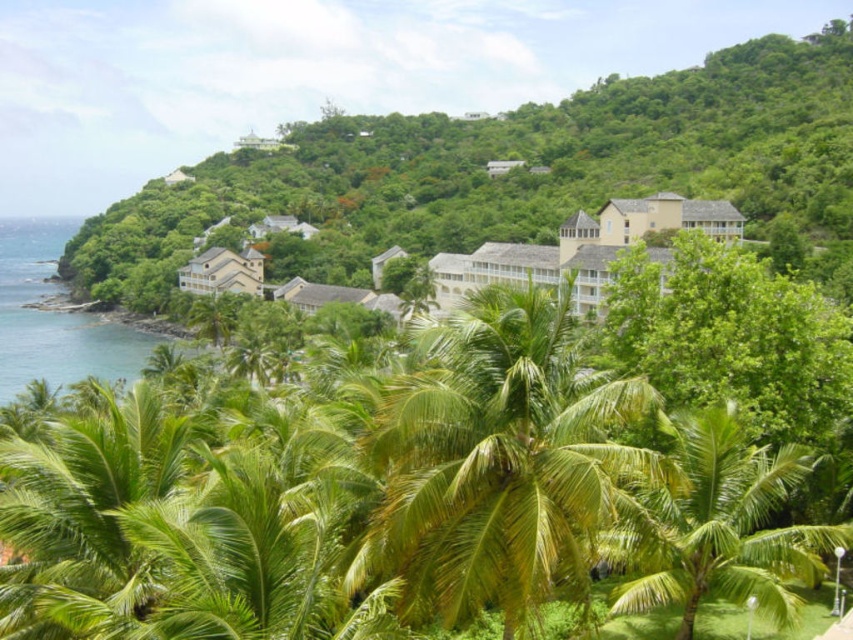
The width and height of the screenshot is (853, 640). Describe the element at coordinates (717, 525) in the screenshot. I see `green leafy palm tree at lower right` at that location.

I want to click on green leafy palm tree at lower right, so click(x=717, y=525).

Who is positioned more to the left, green leafy palm tree at center or yellow matte building at center?

Positioned to the left is green leafy palm tree at center.

Is point (572, 337) closer to camera compared to point (537, 275)?

Yes, point (572, 337) is closer to viewer.

Locate an element on the screen. The width and height of the screenshot is (853, 640). green leafy palm tree at center is located at coordinates (498, 460).

Between point (805, 532) and point (248, 284), which one is positioned behind?

The point (248, 284) is behind.

Measure the distance between green leafy palm tree at lower right and camera.

green leafy palm tree at lower right is 24.17 meters from camera.

Which is in front, point (712, 552) or point (239, 262)?

Positioned in front is point (712, 552).

Locate an element on the screen. Image resolution: width=853 pixels, height=640 pixels. green leafy palm tree at lower right is located at coordinates (717, 525).